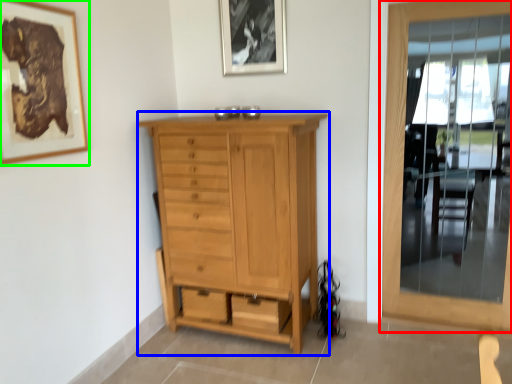
Question: Which object is the farthest from door (highlighted by a red box)? Choose among these: chest of drawers (highlighted by a blue box) or picture frame (highlighted by a green box).

Choices:
 (A) chest of drawers
 (B) picture frame

Answer: (B)